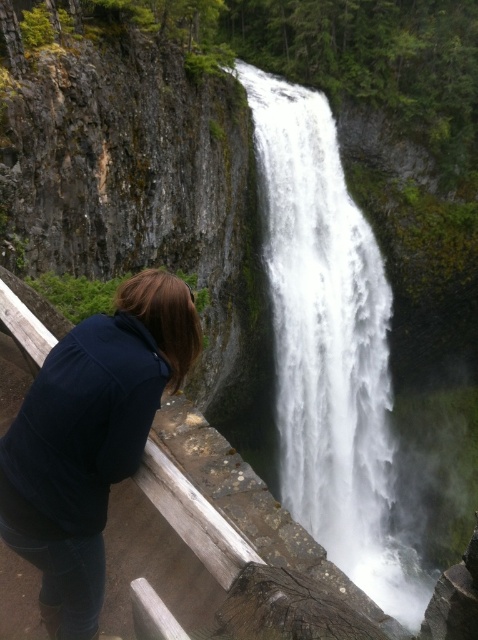
You are standing at the center of the wooden platform and want to take a photo of the white frothy water at center. In which direction should you move to get closer to it?

The white frothy water at center is located at point 0.544 on the x axis and 0.690 on the y axis. Since you are at the center of the wooden platform, which is at point 0.5 on both axes, you should move slightly to the right and forward to reach the white frothy water at center.

You are standing at the point marked as point (329, 348). What do you see directly in front of you?

You see white frothy water at center directly in front of you at point (329, 348).

You are a photographer trying to capture the waterfall and the person in the scene. Based on their positions, will the white frothy water at center appear above or below the dark blue hoodie at lower left in your photo?

The white frothy water at center is located above the dark blue hoodie at lower left, so it will appear above in the photo.